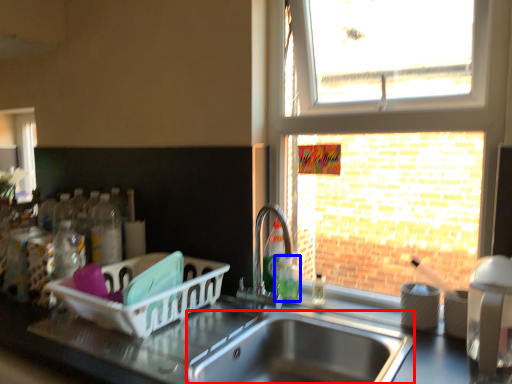
Question: Which object is further to the camera taking this photo, sink (highlighted by a red box) or bottle (highlighted by a blue box)?

Choices:
 (A) sink
 (B) bottle

Answer: (B)